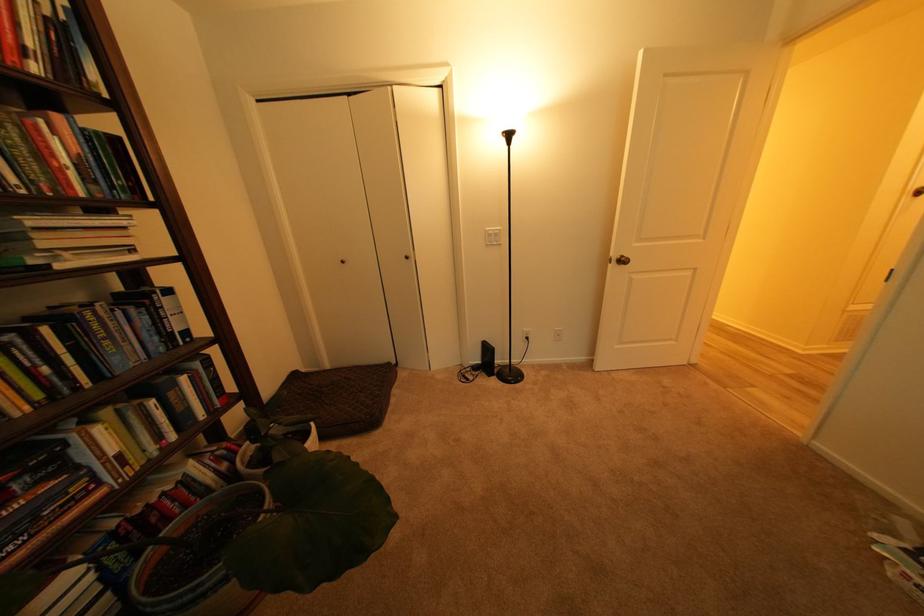
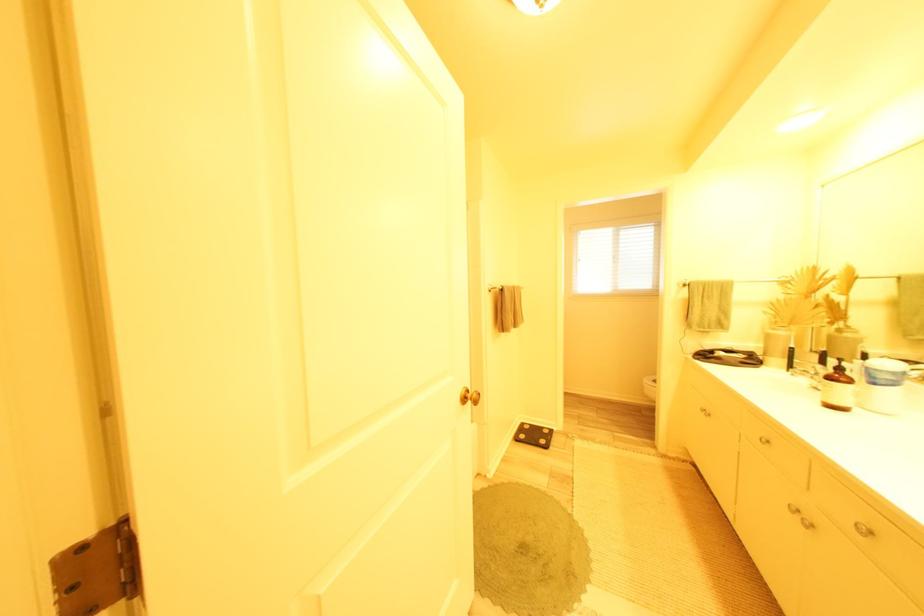
Question: I am providing you with two images of the same scene from different viewpoints. Which of the following objects are not visible in image2?

Choices:
 (A) closet door knob
 (B) blue jar lid
 (C) ceramic spoon rest
 (D) faucet handle

Answer: (A)